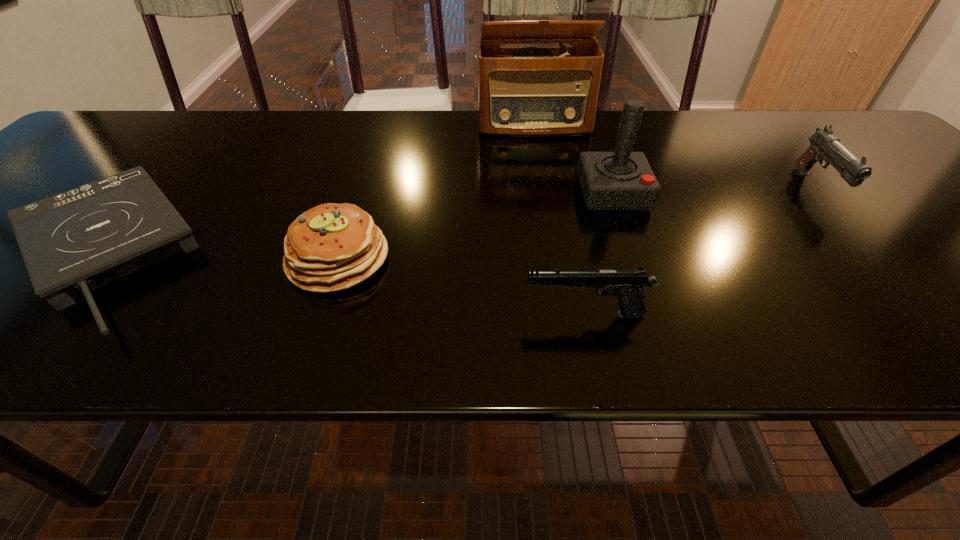
Where is `the farthest object`? the farthest object is located at coordinates (523, 91).

Find the location of `radio receiver`. radio receiver is located at coordinates (523, 91).

Find the location of a particular element. The width and height of the screenshot is (960, 540). the second tallest object is located at coordinates (621, 180).

Where is `the rightmost object`? The width and height of the screenshot is (960, 540). the rightmost object is located at coordinates (824, 145).

Where is `the right gun`? the right gun is located at coordinates (824, 145).

I want to click on the nearer gun, so [x=628, y=285].

You are a GUI agent. You are given a task and a screenshot of the screen. Output one action in this format:
    pyautogui.click(x=<x>, y=<y>)
    Task: Click on the second object from left to right
    
    Given the screenshot: What is the action you would take?
    pyautogui.click(x=331, y=247)

I want to click on free space located 0.110m on the front panel of the tallest object, so coord(540,161).

Identify the location of free space located on the base of the fifth shortest object. (633, 251).

I want to click on vacant space located in the direction the rightmost object is aimed, so click(934, 316).